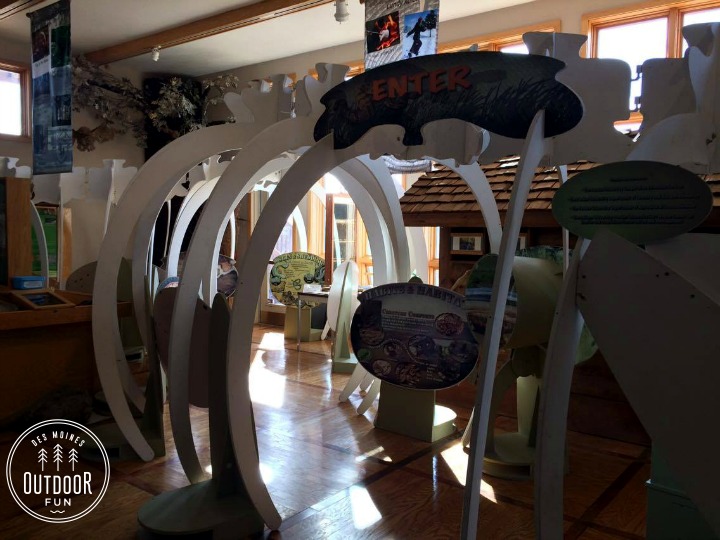
At what (x,y) coordinates should I click in order to perform the action: click on window pane. Please return your answer as a coordinate pair (x, y). The image size is (720, 540). Looking at the image, I should click on (713, 14).